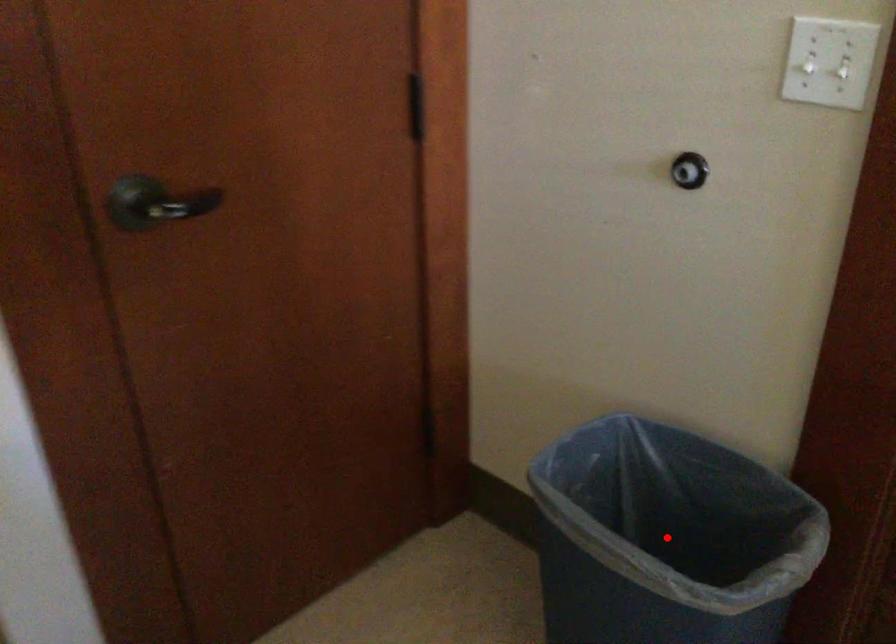
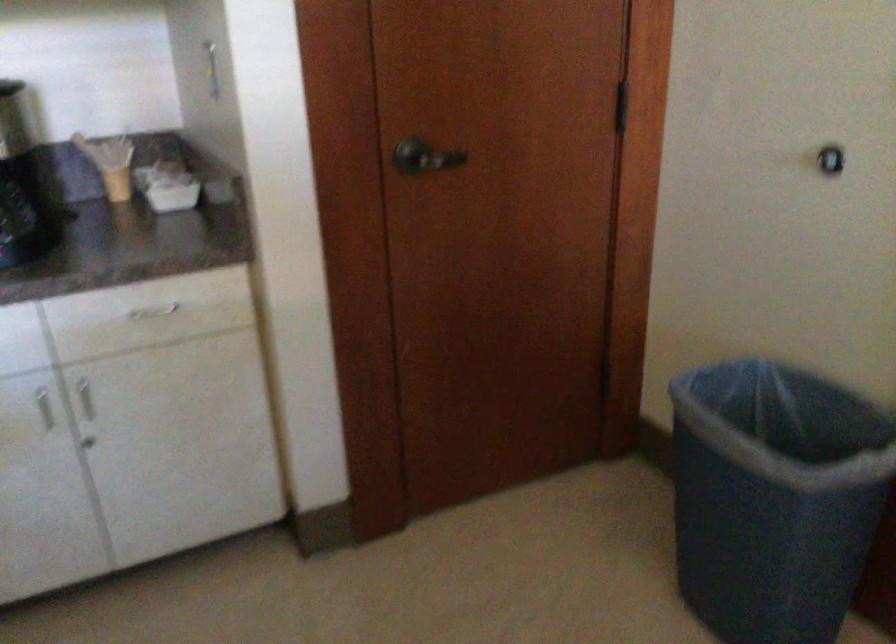
Find the pixel in the second image that matches the highlighted location in the first image.

(788, 466)